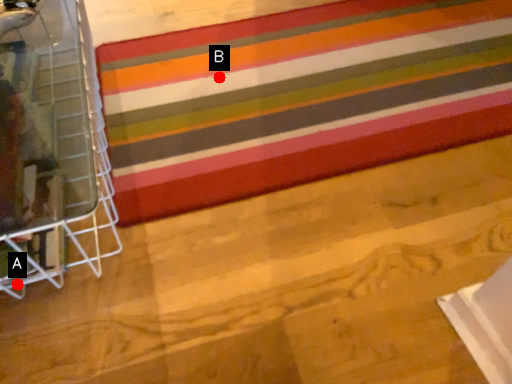
Question: Two points are circled on the image, labeled by A and B beside each circle. Which point is closer to the camera taking this photo?

Choices:
 (A) A is closer
 (B) B is closer

Answer: (A)